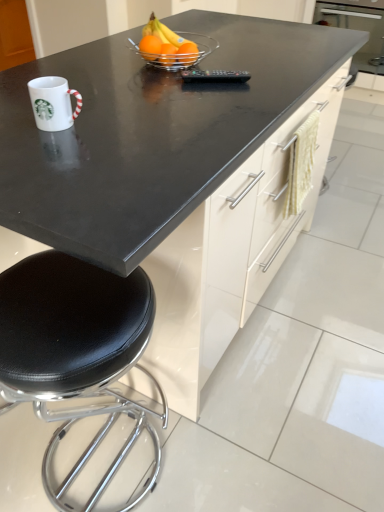
At what (x,y) coordinates should I click in order to perform the action: click on vacant area located to the right-hand side of orange matte at center, arranged as the second orange when viewed from the right. Please return your answer as a coordinate pair (x, y). This screenshot has width=384, height=512. Looking at the image, I should click on (230, 64).